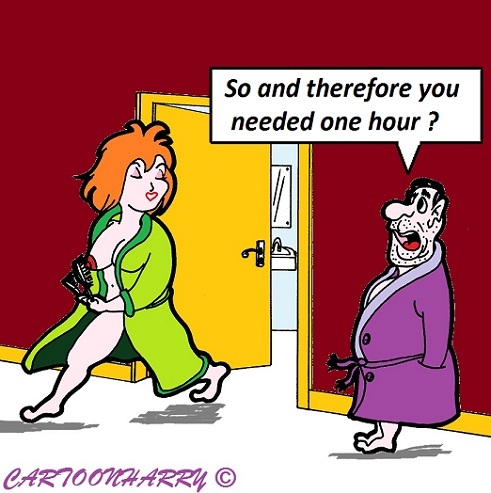
This screenshot has width=491, height=493. What are the coordinates of `bathroom mirror` in the screenshot? It's located at (281, 195).